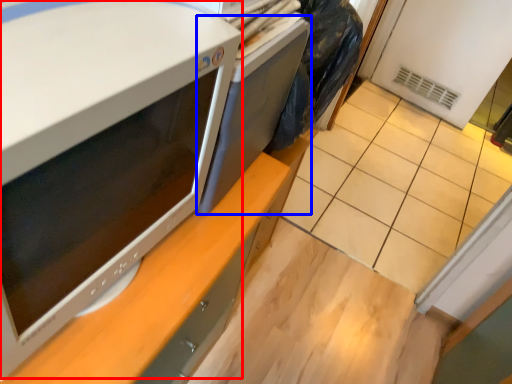
Question: Which of the following is the closest to the observer, home appliance (highlighted by a red box) or desktop (highlighted by a blue box)?

Choices:
 (A) home appliance
 (B) desktop

Answer: (A)